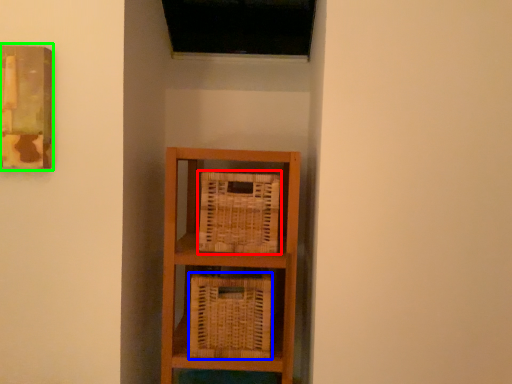
Question: Estimate the real-world distances between objects in this image. Which object is closer to basket (highlighted by a red box), basket (highlighted by a blue box) or picture frame (highlighted by a green box)?

Choices:
 (A) basket
 (B) picture frame

Answer: (A)